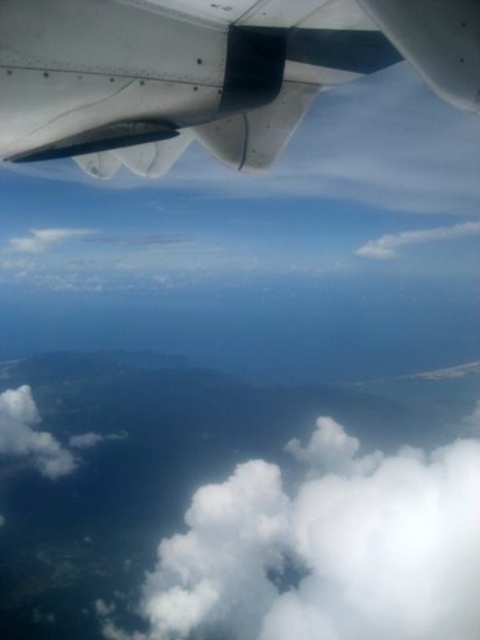
You are a passenger on the airplane and looking out the window. You see the metallic gray wing at upper left and the white fluffy cloud at lower center. Which object is closer to you?

The metallic gray wing at upper left is closer to you because it is in front of the white fluffy cloud at lower center.

You are a passenger on the airplane looking out the window. You see two points in the landscape below. The first point is at coordinates point (445, 6) and the second is at point (226, 612). Which point is closer to the airplane?

Point (445, 6) is in front of point (226, 612), so it is closer to the airplane.